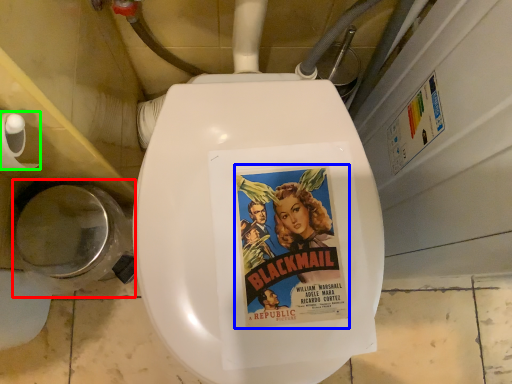
Question: Which is farther away from toilet bowl (highlighted by a red box)? fiction book (highlighted by a blue box) or toilet paper (highlighted by a green box)?

Choices:
 (A) fiction book
 (B) toilet paper

Answer: (A)